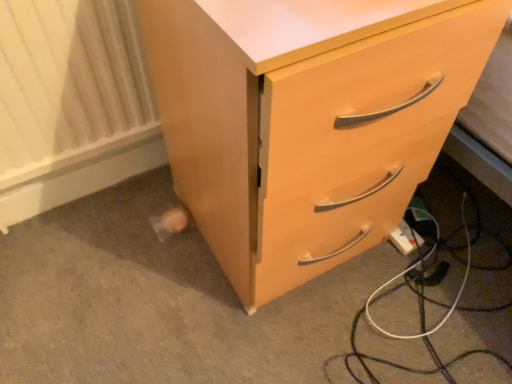
The width and height of the screenshot is (512, 384). I want to click on matte wood chest of drawers at lower right, so click(306, 123).

Measure the distance between point (267,228) and camera.

They are 64.70 centimeters apart.

Locate an element on the screen. The image size is (512, 384). white textured radiator at lower left is located at coordinates (69, 85).

Relative to white plastic extension cord at lower right, is white textured radiator at lower left in front or behind?

white textured radiator at lower left is in front of white plastic extension cord at lower right.

Is white textured radiator at lower left far away from white plastic extension cord at lower right?

No, white textured radiator at lower left is in close proximity to white plastic extension cord at lower right.

Based on their positions, is white textured radiator at lower left located to the left or right of white plastic extension cord at lower right?

Based on their positions, white textured radiator at lower left is located to the left of white plastic extension cord at lower right.

From a real-world perspective, is white textured radiator at lower left over white plastic extension cord at lower right?

Yes, from a real-world perspective, white textured radiator at lower left is on top of white plastic extension cord at lower right.

Which of these two, matte wood chest of drawers at lower right or white plastic extension cord at lower right, is smaller?

Smaller between the two is white plastic extension cord at lower right.

Is matte wood chest of drawers at lower right at the right side of white plastic extension cord at lower right?

In fact, matte wood chest of drawers at lower right is to the left of white plastic extension cord at lower right.

Considering their positions, is matte wood chest of drawers at lower right located in front of or behind white plastic extension cord at lower right?

matte wood chest of drawers at lower right is in front of white plastic extension cord at lower right.

Could you tell me if matte wood chest of drawers at lower right is facing white plastic extension cord at lower right?

No, matte wood chest of drawers at lower right is not oriented towards white plastic extension cord at lower right.

From a real-world perspective, is white textured radiator at lower left positioned under matte wood chest of drawers at lower right based on gravity?

Yes, from a real-world perspective, white textured radiator at lower left is under matte wood chest of drawers at lower right.

Is white textured radiator at lower left wider than matte wood chest of drawers at lower right?

No, white textured radiator at lower left is not wider than matte wood chest of drawers at lower right.

Based on the photo, which object is closer to the camera, white textured radiator at lower left or matte wood chest of drawers at lower right?

matte wood chest of drawers at lower right is more forward.

From the image's perspective, which is below, white textured radiator at lower left or matte wood chest of drawers at lower right?

matte wood chest of drawers at lower right appears lower in the image.

What's the angular difference between white plastic extension cord at lower right and matte wood chest of drawers at lower right's facing directions?

0.0611 degrees separate the facing orientations of white plastic extension cord at lower right and matte wood chest of drawers at lower right.

Measure the distance between white plastic extension cord at lower right and matte wood chest of drawers at lower right.

white plastic extension cord at lower right and matte wood chest of drawers at lower right are 49.08 centimeters apart from each other.

From a real-world perspective, which is physically below, white plastic extension cord at lower right or matte wood chest of drawers at lower right?

white plastic extension cord at lower right, from a real-world perspective.

Is matte wood chest of drawers at lower right surrounded by white plastic extension cord at lower right?

No, matte wood chest of drawers at lower right is not inside white plastic extension cord at lower right.

From the image's perspective, is white plastic extension cord at lower right located above or below white textured radiator at lower left?

white plastic extension cord at lower right is below white textured radiator at lower left.

What's the angular difference between white plastic extension cord at lower right and white textured radiator at lower left's facing directions?

1.38 degrees separate the facing orientations of white plastic extension cord at lower right and white textured radiator at lower left.

Does white plastic extension cord at lower right have a smaller size compared to white textured radiator at lower left?

Yes, white plastic extension cord at lower right is smaller than white textured radiator at lower left.

Does white plastic extension cord at lower right come in front of white textured radiator at lower left?

No, white plastic extension cord at lower right is further to the viewer.

Does matte wood chest of drawers at lower right turn towards white textured radiator at lower left?

No, matte wood chest of drawers at lower right is not aimed at white textured radiator at lower left.

Can you tell me how much matte wood chest of drawers at lower right and white textured radiator at lower left differ in facing direction?

They differ by 1.44 degrees in their facing directions.

Is matte wood chest of drawers at lower right touching white textured radiator at lower left?

matte wood chest of drawers at lower right is not next to white textured radiator at lower left, and they're not touching.

Considering the relative sizes of matte wood chest of drawers at lower right and white textured radiator at lower left in the image provided, is matte wood chest of drawers at lower right shorter than white textured radiator at lower left?

In fact, matte wood chest of drawers at lower right may be taller than white textured radiator at lower left.

Where is `extension cord that is on the right side of white textured radiator at lower left`? The image size is (512, 384). extension cord that is on the right side of white textured radiator at lower left is located at coordinates (405, 238).

Find the location of a particular element. extension cord below the matte wood chest of drawers at lower right (from the image's perspective) is located at coordinates 405,238.

Looking at the image, which one is located closer to white plastic extension cord at lower right, matte wood chest of drawers at lower right or white textured radiator at lower left?

matte wood chest of drawers at lower right lies closer to white plastic extension cord at lower right than the other object.

Which object lies nearer to the anchor point white plastic extension cord at lower right, white textured radiator at lower left or matte wood chest of drawers at lower right?

Among the two, matte wood chest of drawers at lower right is located nearer to white plastic extension cord at lower right.

Estimate the real-world distances between objects in this image. Which object is further from matte wood chest of drawers at lower right, white textured radiator at lower left or white plastic extension cord at lower right?

white plastic extension cord at lower right.

When comparing their distances from white textured radiator at lower left, does matte wood chest of drawers at lower right or white plastic extension cord at lower right seem further?

white plastic extension cord at lower right is positioned further to the anchor white textured radiator at lower left.

Considering their positions, is white plastic extension cord at lower right positioned closer to white textured radiator at lower left than matte wood chest of drawers at lower right?

The object closer to white textured radiator at lower left is matte wood chest of drawers at lower right.

When comparing their distances from matte wood chest of drawers at lower right, does white plastic extension cord at lower right or white textured radiator at lower left seem further?

The object further to matte wood chest of drawers at lower right is white plastic extension cord at lower right.

Where is `chest of drawers between white textured radiator at lower left and white plastic extension cord at lower right`? The width and height of the screenshot is (512, 384). chest of drawers between white textured radiator at lower left and white plastic extension cord at lower right is located at coordinates (306, 123).